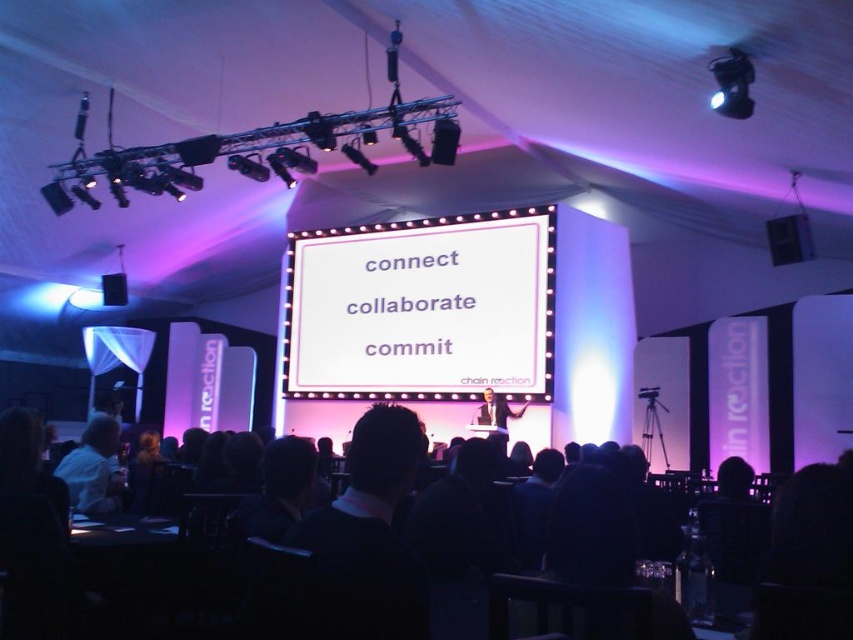
Does black matte speaker at upper right come behind light brown wooden podium at center?

No, black matte speaker at upper right is closer to the viewer.

From the picture: How distant is black matte speaker at upper right from light brown wooden podium at center?

black matte speaker at upper right and light brown wooden podium at center are 3.05 meters apart.

The height and width of the screenshot is (640, 853). I want to click on black matte speaker at upper right, so click(788, 237).

Between light brown wooden podium at center and matte black speaker at upper center, which one appears on the left side from the viewer's perspective?

matte black speaker at upper center

How much distance is there between light brown wooden podium at center and matte black speaker at upper center?

The distance of light brown wooden podium at center from matte black speaker at upper center is 9.61 feet.

The height and width of the screenshot is (640, 853). What do you see at coordinates (496, 417) in the screenshot?
I see `light brown wooden podium at center` at bounding box center [496, 417].

The width and height of the screenshot is (853, 640). Find the location of `light brown wooden podium at center`. light brown wooden podium at center is located at coordinates (496, 417).

Which is in front, point (309, 269) or point (25, 577)?

Positioned in front is point (25, 577).

Based on the photo, between white matte projection screen at center and black fabric chairs at lower center, which one has more height?

Standing taller between the two is white matte projection screen at center.

Identify the location of white matte projection screen at center. (422, 308).